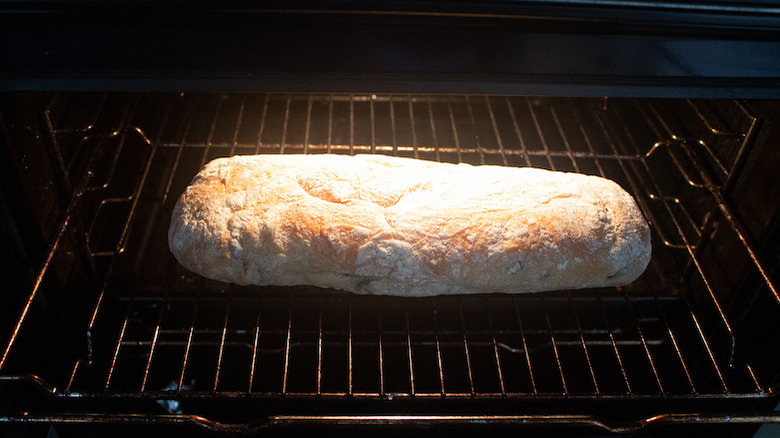
Image resolution: width=780 pixels, height=438 pixels. I want to click on oven, so click(x=356, y=119).